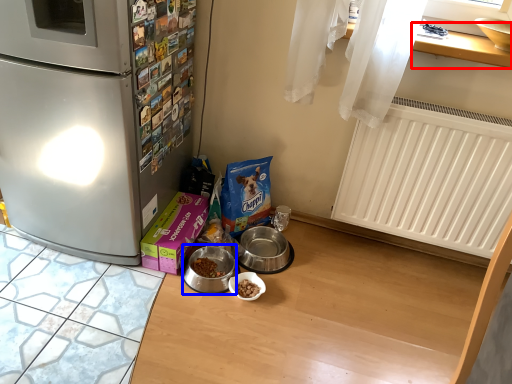
Question: Which point is further to the camera, window sill (highlighted by a red box) or appliance (highlighted by a blue box)?

Choices:
 (A) window sill
 (B) appliance

Answer: (B)